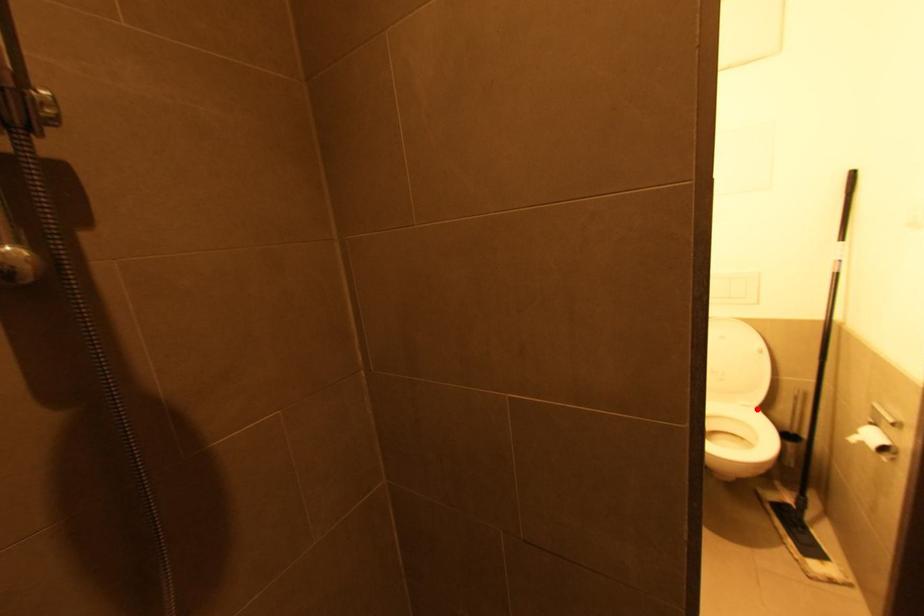
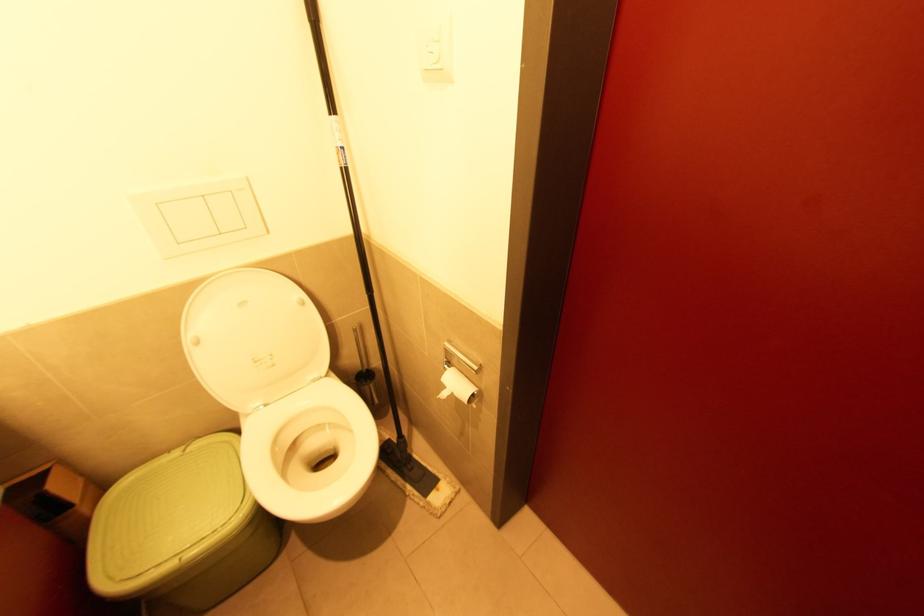
In the second image, find the point that corresponds to the highlighted location in the first image.

(329, 377)